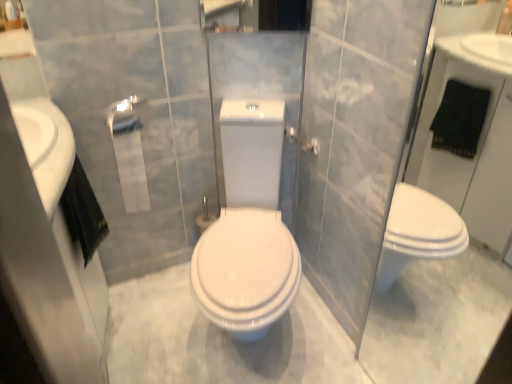
This screenshot has width=512, height=384. What are the coordinates of `free point above white glossy sink at left (from a real-world perspective)` in the screenshot? It's located at (28, 127).